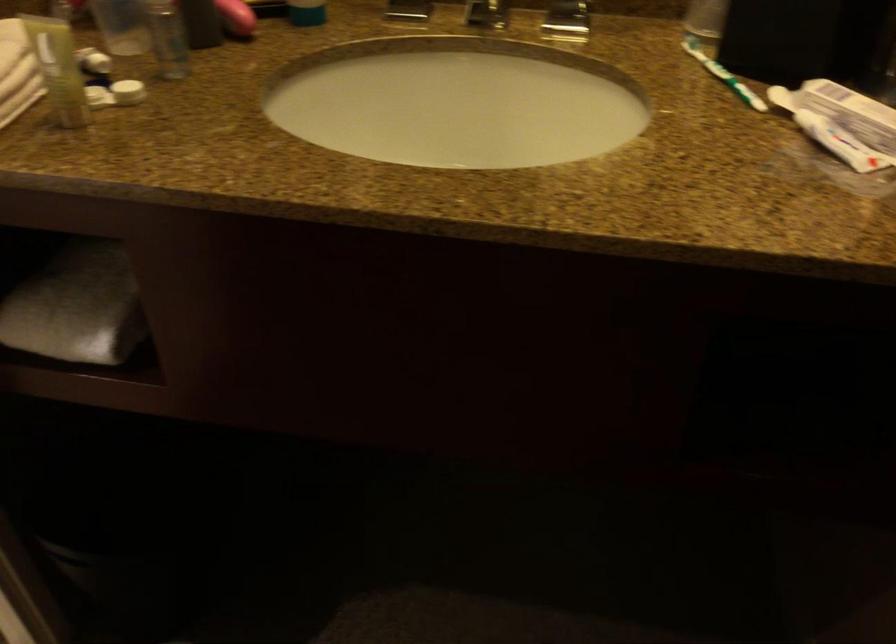
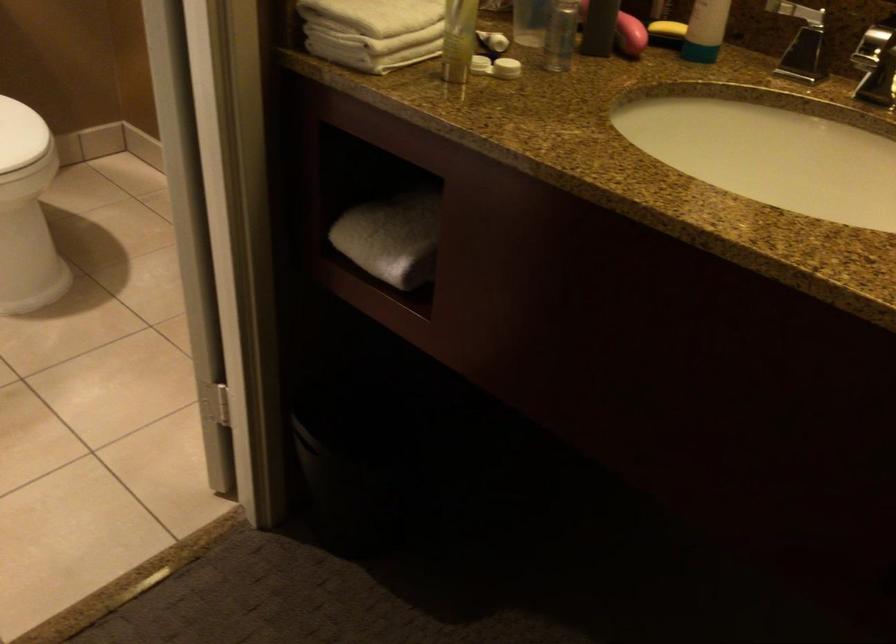
The point at (126, 91) is marked in the first image. Where is the corresponding point in the second image?

(506, 68)